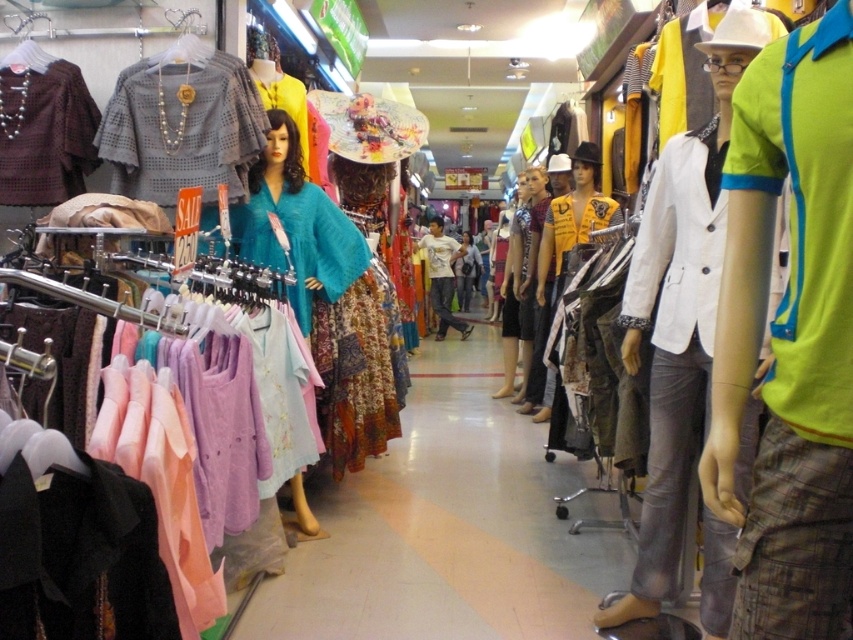
Looking at this image, is matte gray blouse at center positioned at the back of matte brown blouse at left?

No, it is in front of matte brown blouse at left.

Does matte gray blouse at center have a greater width compared to matte brown blouse at left?

Yes, matte gray blouse at center is wider than matte brown blouse at left.

You are a GUI agent. You are given a task and a screenshot of the screen. Output one action in this format:
    pyautogui.click(x=<x>, y=<y>)
    Task: Click on the matte gray blouse at center
    This screenshot has height=640, width=853.
    Given the screenshot: What is the action you would take?
    pyautogui.click(x=183, y=124)

Locate an element on the screen. matte gray blouse at center is located at coordinates (183, 124).

Is matte gray blouse at center shorter than floral fabric dress at center?

→ Correct, matte gray blouse at center is not as tall as floral fabric dress at center.

Locate an element on the screen. The height and width of the screenshot is (640, 853). matte gray blouse at center is located at coordinates (183, 124).

The height and width of the screenshot is (640, 853). What are the coordinates of `matte gray blouse at center` in the screenshot? It's located at (183, 124).

Does matte brown blouse at left have a lesser height compared to floral fabric dress at center?

Yes, matte brown blouse at left is shorter than floral fabric dress at center.

Is the position of matte brown blouse at left less distant than that of floral fabric dress at center?

That is True.

The image size is (853, 640). In order to click on matte brown blouse at left in this screenshot , I will do `click(44, 129)`.

This screenshot has width=853, height=640. I want to click on matte brown blouse at left, so click(x=44, y=129).